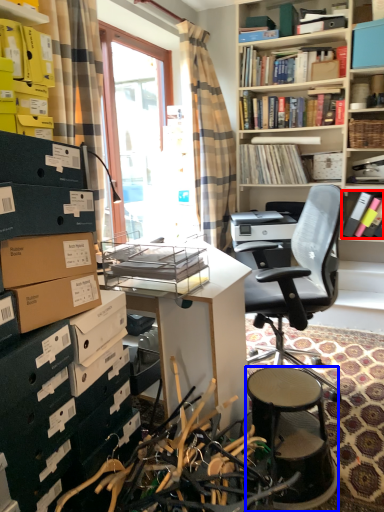
Question: Which object appears closest to the camera in this image, book (highlighted by a red box) or stool (highlighted by a blue box)?

Choices:
 (A) book
 (B) stool

Answer: (B)